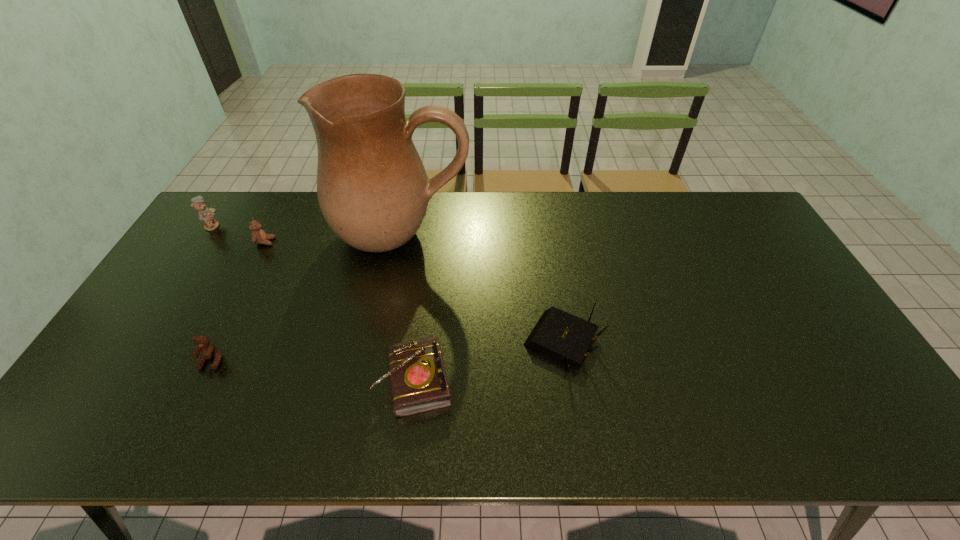
In the image, there is a desktop. In order to click on blank space at the right edge in this screenshot , I will do `click(770, 241)`.

Find the location of a particular element. The height and width of the screenshot is (540, 960). blank region between the leftmost object and the second farthest teddy bear is located at coordinates (239, 234).

Where is `vacant space that is in between the leftmost teddy bear and the shortest object`? The width and height of the screenshot is (960, 540). vacant space that is in between the leftmost teddy bear and the shortest object is located at coordinates (314, 303).

The width and height of the screenshot is (960, 540). I want to click on free space between the second farthest teddy bear and the shortest object, so click(x=340, y=311).

This screenshot has width=960, height=540. What are the coordinates of `empty space between the cream pitcher and the shortest object` in the screenshot? It's located at (409, 308).

You are a GUI agent. You are given a task and a screenshot of the screen. Output one action in this format:
    pyautogui.click(x=<x>, y=<y>)
    Task: Click on the free space between the router and the second farthest teddy bear
    This screenshot has height=540, width=960.
    Given the screenshot: What is the action you would take?
    pyautogui.click(x=414, y=292)

I want to click on empty space that is in between the farthest teddy bear and the cream pitcher, so click(307, 230).

The height and width of the screenshot is (540, 960). Find the location of `empty location between the second tallest object and the tallest object`. empty location between the second tallest object and the tallest object is located at coordinates (307, 230).

Locate an element on the screen. The height and width of the screenshot is (540, 960). vacant area between the nearest teddy bear and the second farthest teddy bear is located at coordinates (238, 301).

Locate an element on the screen. empty space between the tallest object and the second farthest teddy bear is located at coordinates (333, 238).